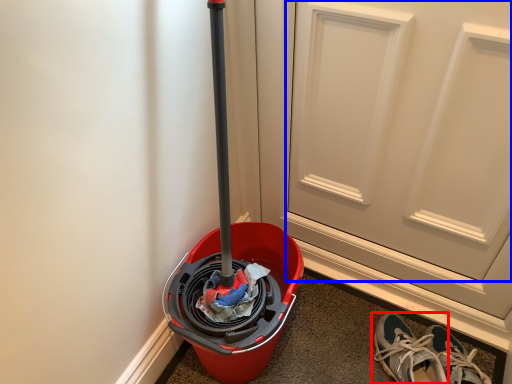
Question: Among these objects, which one is farthest to the camera, footwear (highlighted by a red box) or door (highlighted by a blue box)?

Choices:
 (A) footwear
 (B) door

Answer: (A)